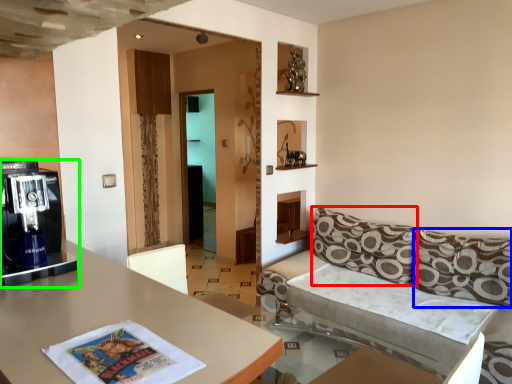
Question: Which object is positioned farthest from pillow (highlighted by a red box)? Select from pillow (highlighted by a blue box) and coffee machine (highlighted by a green box).

Choices:
 (A) pillow
 (B) coffee machine

Answer: (B)